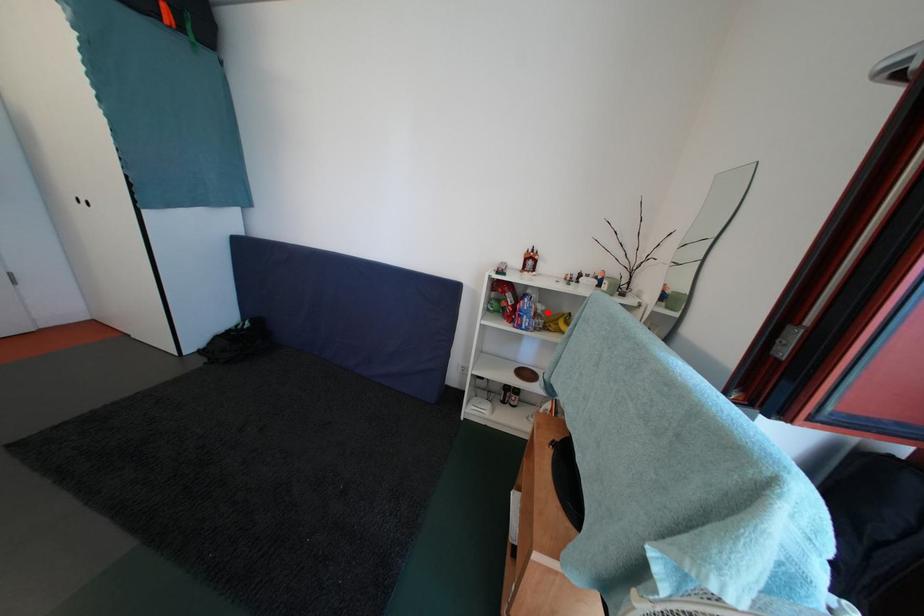
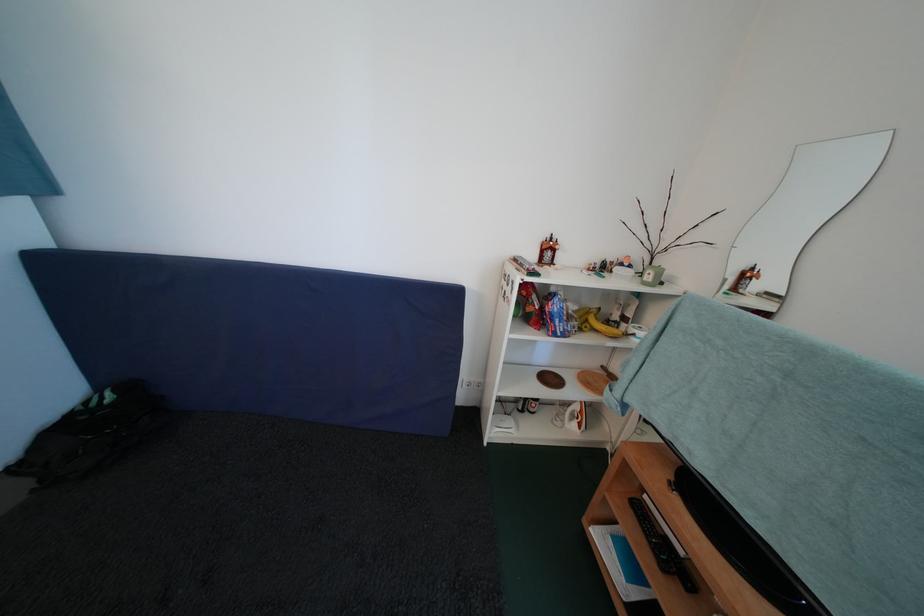
Where in the second image is the point corresponding to the highlighted location from the first image?

(579, 313)